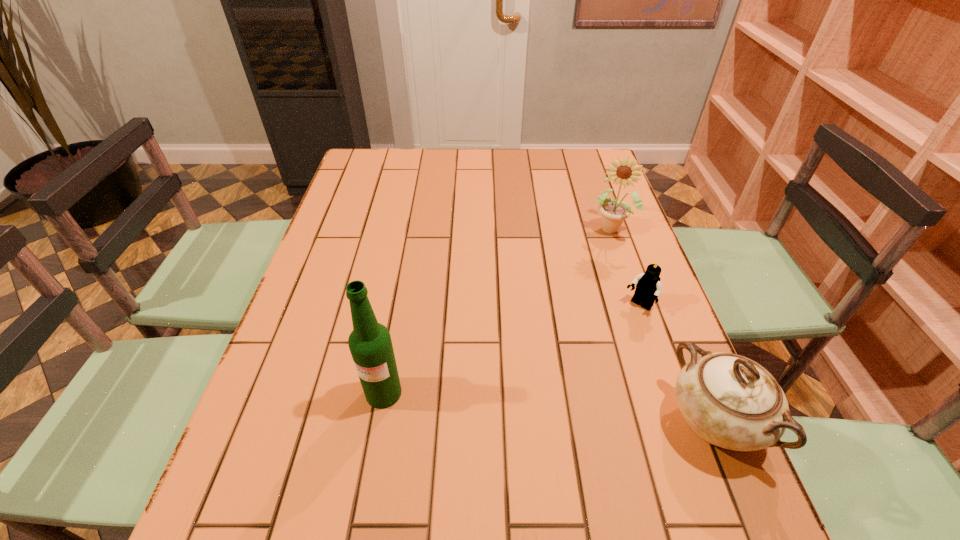
In the image, there is a desktop. Where is `vacant space at the far edge`? This screenshot has height=540, width=960. vacant space at the far edge is located at coordinates (545, 153).

The height and width of the screenshot is (540, 960). I want to click on free space at the near edge of the desktop, so point(396,459).

At what (x,y) coordinates should I click in order to perform the action: click on free location at the left edge of the desktop. Please return your answer as a coordinate pair (x, y). The width and height of the screenshot is (960, 540). Looking at the image, I should click on (335, 312).

What are the coordinates of `vacant space at the right edge of the desktop` in the screenshot? It's located at (651, 354).

You are a GUI agent. You are given a task and a screenshot of the screen. Output one action in this format:
    pyautogui.click(x=<x>, y=<y>)
    Task: Click on the vacant region at the near left corner of the desktop
    The image size is (960, 540).
    Given the screenshot: What is the action you would take?
    pyautogui.click(x=254, y=475)

Where is `free space at the far right corner of the desktop`? free space at the far right corner of the desktop is located at coordinates (589, 156).

The width and height of the screenshot is (960, 540). What are the coordinates of `free space between the Lego and the leftmost object` in the screenshot? It's located at (512, 349).

Locate an element on the screen. Image resolution: width=960 pixels, height=540 pixels. vacant space that is in between the Lego and the third tallest object is located at coordinates (677, 363).

The width and height of the screenshot is (960, 540). What are the coordinates of `free spot between the leftmost object and the third tallest object` in the screenshot? It's located at (549, 407).

Find the location of `vacant space in between the leftmost object and the chinaware`. vacant space in between the leftmost object and the chinaware is located at coordinates (549, 407).